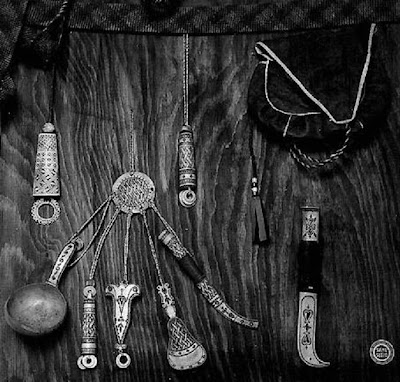
Where is `handle`? Image resolution: width=400 pixels, height=382 pixels. handle is located at coordinates (60, 264).